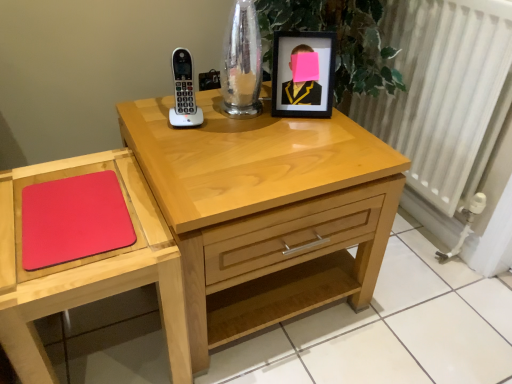
The width and height of the screenshot is (512, 384). What are the coordinates of `spots to the right of white plastic phone at upper center` in the screenshot? It's located at (241, 128).